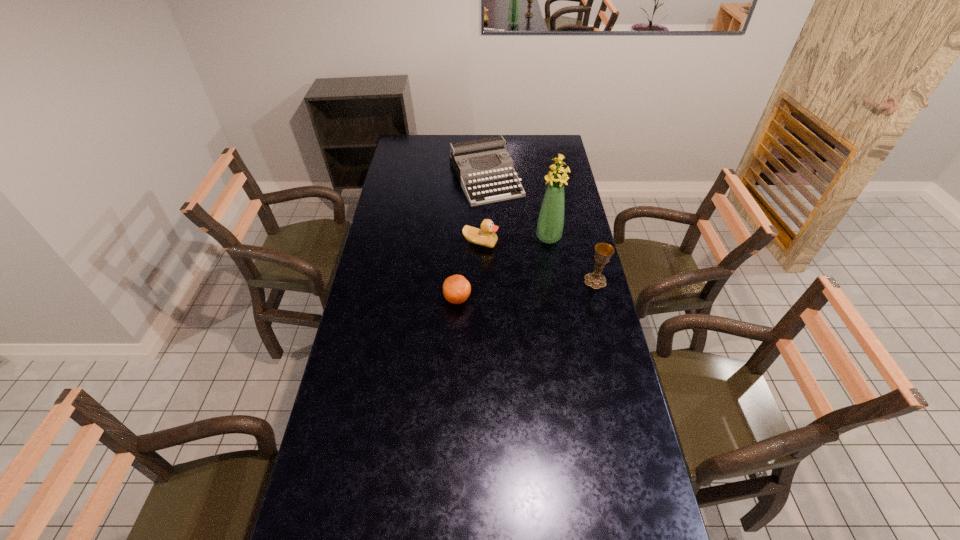
Where is `free space between the duck and the bouquet`? free space between the duck and the bouquet is located at coordinates (515, 240).

Identify the location of vacant point located between the farthest object and the duck. (483, 211).

The image size is (960, 540). What are the coordinates of `empty space between the orange and the duck` in the screenshot? It's located at (468, 271).

Find the location of `vacant space that is in between the farthest object and the duck`. vacant space that is in between the farthest object and the duck is located at coordinates (483, 211).

Find the location of a particular element. The height and width of the screenshot is (540, 960). unoccupied position between the bouquet and the duck is located at coordinates (515, 240).

The image size is (960, 540). In order to click on free space between the bouquet and the chalice in this screenshot , I will do `click(572, 259)`.

I want to click on object that ranks as the closest to the farthest object, so click(550, 224).

I want to click on object that can be found as the fourth closest to the bouquet, so click(456, 289).

What are the coordinates of `vacant space that satisfies the following two spatial constraints: 1. on the front side of the duck; 2. on the right side of the fourth shortest object` in the screenshot? It's located at (480, 281).